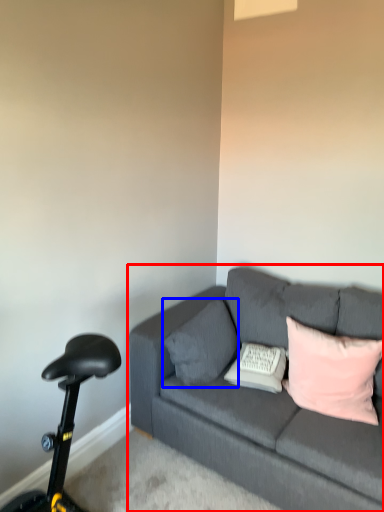
Question: Which object appears closest to the camera in this image, studio couch (highlighted by a red box) or pillow (highlighted by a blue box)?

Choices:
 (A) studio couch
 (B) pillow

Answer: (A)